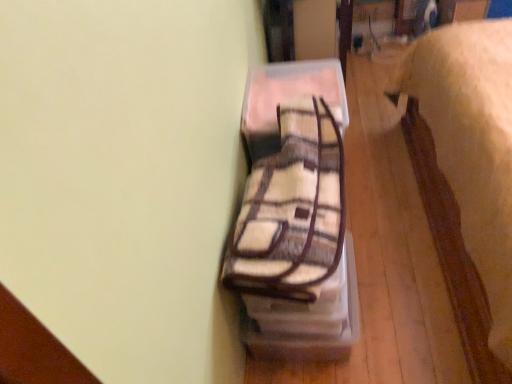
Locate an element on the screen. plaid fleece blanket at center is located at coordinates (292, 209).

The width and height of the screenshot is (512, 384). What do you see at coordinates (292, 209) in the screenshot?
I see `plaid fleece blanket at center` at bounding box center [292, 209].

Locate an element on the screen. The height and width of the screenshot is (384, 512). plaid fleece blanket at center is located at coordinates (292, 209).